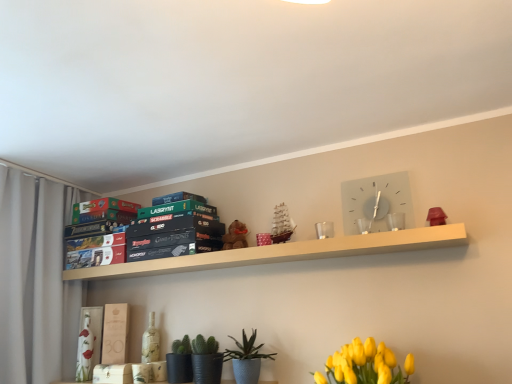
Question: Considering the relative sizes of green matte cactus at lower center, which appears as the 1th plant when viewed from the left, and white fabric curtain at left in the image provided, is green matte cactus at lower center, which appears as the 1th plant when viewed from the left, thinner than white fabric curtain at left?

Choices:
 (A) yes
 (B) no

Answer: (A)

Question: Considering the relative sizes of green matte cactus at lower center, the 2th plant from the right, and white fabric curtain at left in the image provided, is green matte cactus at lower center, the 2th plant from the right, shorter than white fabric curtain at left?

Choices:
 (A) no
 (B) yes

Answer: (B)

Question: Is green matte cactus at lower center, which appears as the 1th plant when viewed from the left, placed right next to white fabric curtain at left?

Choices:
 (A) yes
 (B) no

Answer: (B)

Question: Considering the relative sizes of green matte cactus at lower center, the 2th plant from the right, and white fabric curtain at left in the image provided, is green matte cactus at lower center, the 2th plant from the right, smaller than white fabric curtain at left?

Choices:
 (A) yes
 (B) no

Answer: (A)

Question: Is green matte cactus at lower center, which appears as the 1th plant when viewed from the left, taller than white fabric curtain at left?

Choices:
 (A) no
 (B) yes

Answer: (A)

Question: Do you think textured blue pot at lower center, arranged as the 1th plant when viewed from the right, is within white glass clock at upper center, or outside of it?

Choices:
 (A) inside
 (B) outside

Answer: (B)

Question: From their relative heights in the image, would you say textured blue pot at lower center, arranged as the 1th plant when viewed from the right, is taller or shorter than white glass clock at upper center?

Choices:
 (A) tall
 (B) short

Answer: (B)

Question: In terms of size, does textured blue pot at lower center, the 2th plant positioned from the left, appear bigger or smaller than white glass clock at upper center?

Choices:
 (A) big
 (B) small

Answer: (A)

Question: Is textured blue pot at lower center, the 2th plant positioned from the left, in front of or behind white glass clock at upper center in the image?

Choices:
 (A) behind
 (B) front

Answer: (B)

Question: From a real-world perspective, is white fabric curtain at left physically located above or below green matte board game at upper center, the fourth paperback book when ordered from bottom to top?

Choices:
 (A) below
 (B) above

Answer: (A)

Question: In the image, is white fabric curtain at left positioned in front of or behind green matte board game at upper center, the 1th paperback book in the top-to-bottom sequence?

Choices:
 (A) front
 (B) behind

Answer: (A)

Question: Looking at their shapes, would you say white fabric curtain at left is wider or thinner than green matte board game at upper center, the fourth paperback book when ordered from bottom to top?

Choices:
 (A) wide
 (B) thin

Answer: (A)

Question: Which is correct: white fabric curtain at left is inside green matte board game at upper center, the fourth paperback book when ordered from bottom to top, or outside of it?

Choices:
 (A) outside
 (B) inside

Answer: (A)

Question: Is matte white book at center, which is the 1th paperback book from bottom to top, spatially inside green matte cactus at lower center, the 2th plant from the right, or outside of it?

Choices:
 (A) outside
 (B) inside

Answer: (A)

Question: Is point (109, 304) positioned closer to the camera than point (186, 377)?

Choices:
 (A) farther
 (B) closer

Answer: (A)